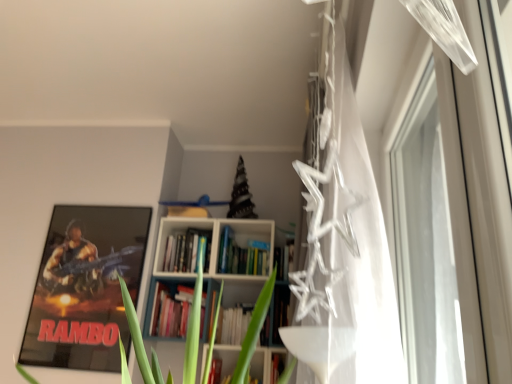
Question: From their relative heights in the image, would you say metallic rambo poster at left is taller or shorter than transparent glass window at upper right?

Choices:
 (A) tall
 (B) short

Answer: (B)

Question: From the image's perspective, relative to transparent glass window at upper right, is metallic rambo poster at left above or below?

Choices:
 (A) above
 (B) below

Answer: (B)

Question: Based on their relative distances, which object is farther from the transparent plastic stars at upper right?

Choices:
 (A) transparent glass window at upper right
 (B) metallic rambo poster at left
 (C) hardcover books at center

Answer: (B)

Question: Which of these objects is positioned closest to the metallic rambo poster at left?

Choices:
 (A) hardcover books at center
 (B) transparent glass window at upper right
 (C) transparent plastic stars at upper right

Answer: (A)